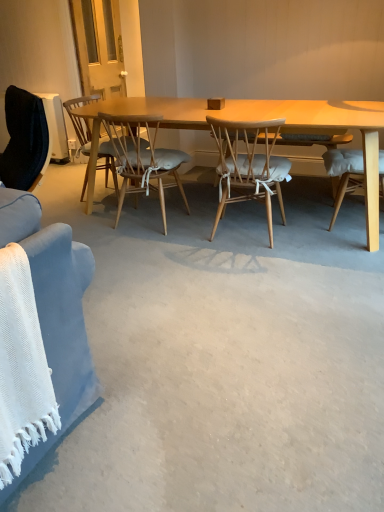
Identify the location of free space on the front side of light brown woven wood chair at center, placed as the 3th chair when sorted from left to right. (259, 267).